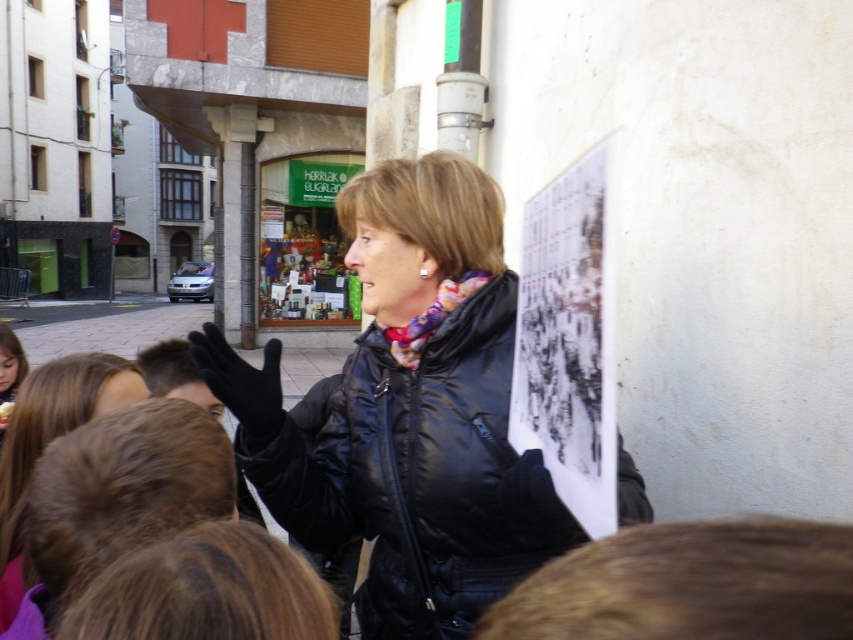
Does black matte jacket at center have a greater height compared to black paper at upper right?

Indeed, black matte jacket at center has a greater height compared to black paper at upper right.

Does black matte jacket at center appear over black paper at upper right?

No.

Is point (430, 524) behind point (521, 232)?

No, it is in front of (521, 232).

The image size is (853, 640). In order to click on black matte jacket at center in this screenshot , I will do `click(409, 412)`.